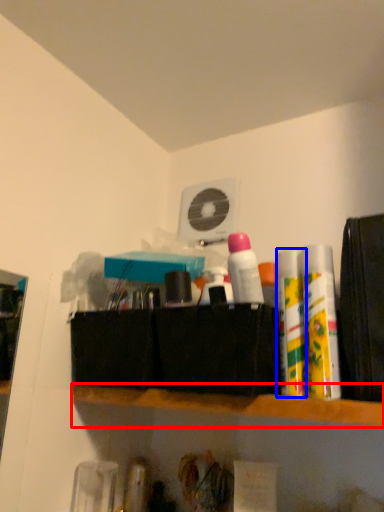
Question: Which of the following is the farthest to the observer, shelf (highlighted by a red box) or toiletry (highlighted by a blue box)?

Choices:
 (A) shelf
 (B) toiletry

Answer: (B)